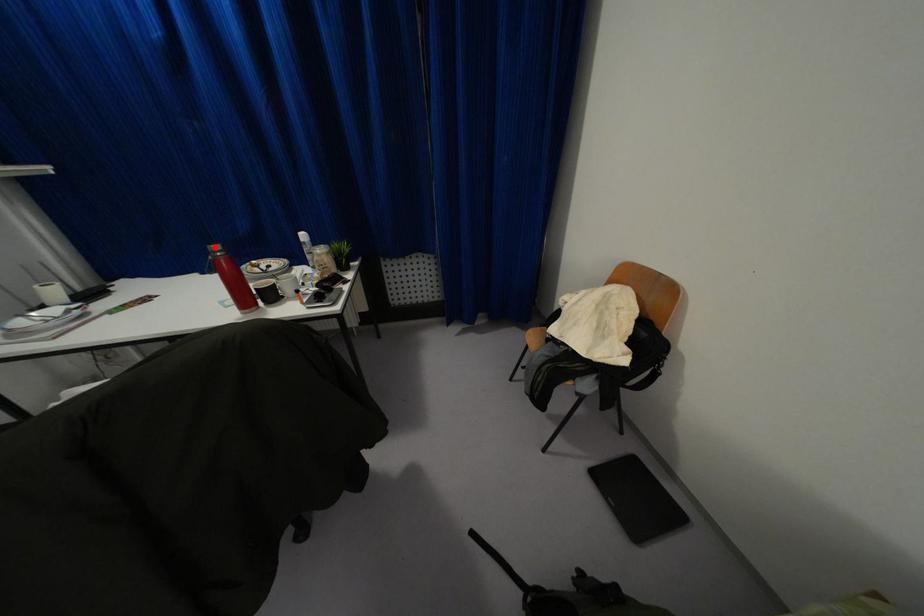
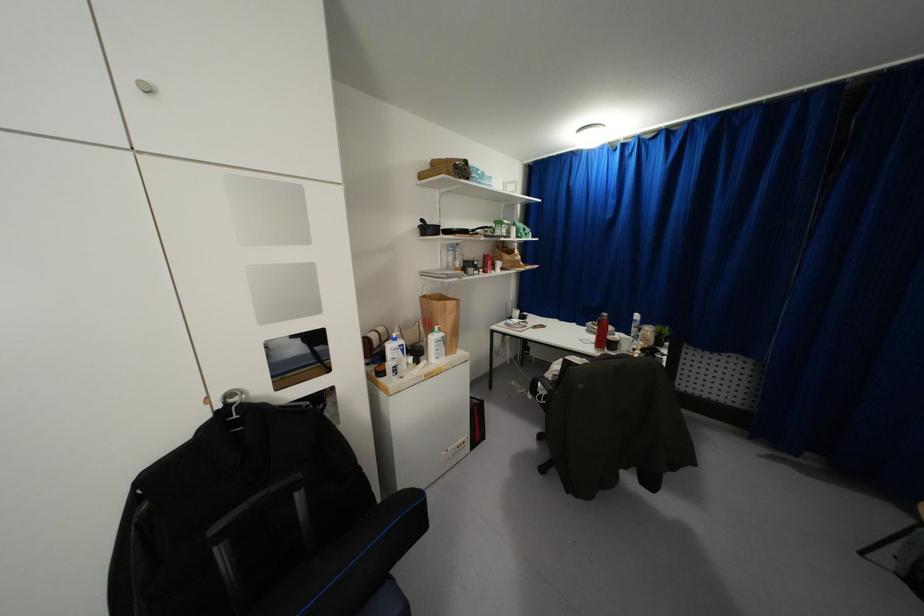
Question: A red point is marked in image1. In image2, is the corresponding 3D point closer to the camera or farther? Reply with the corresponding letter.

Choices:
 (A) The corresponding 3D point is closer.
 (B) The corresponding 3D point is farther.

Answer: (A)